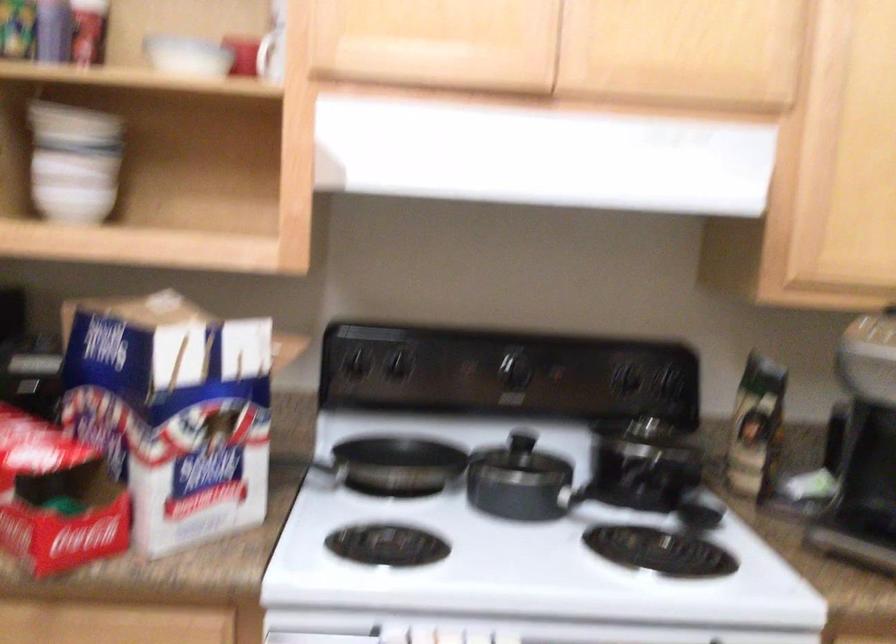
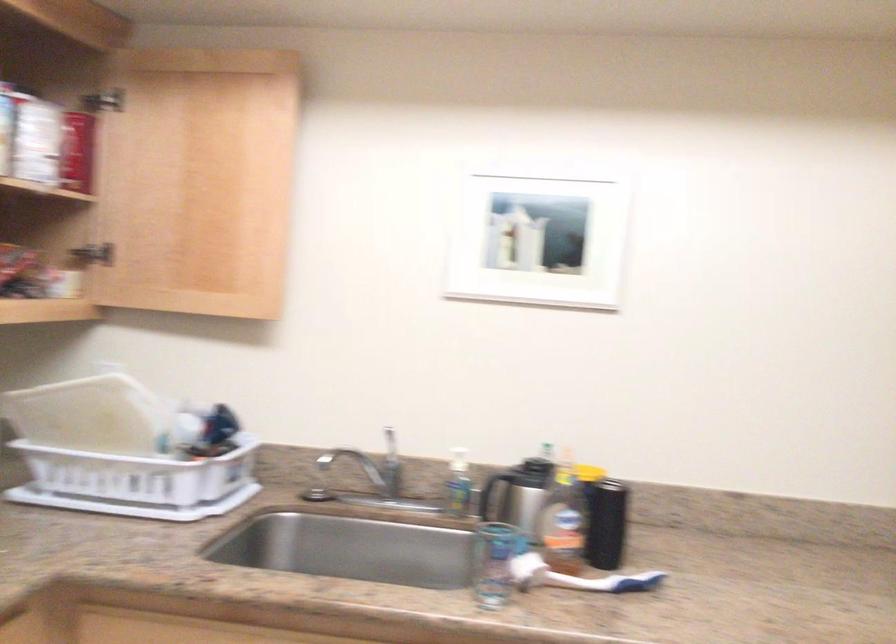
Question: The camera is either moving clockwise (left) or counter-clockwise (right) around the object. The first image is from the beginning of the video and the second image is from the end. Is the camera moving left or right when shooting the video?

Choices:
 (A) Left
 (B) Right

Answer: (B)